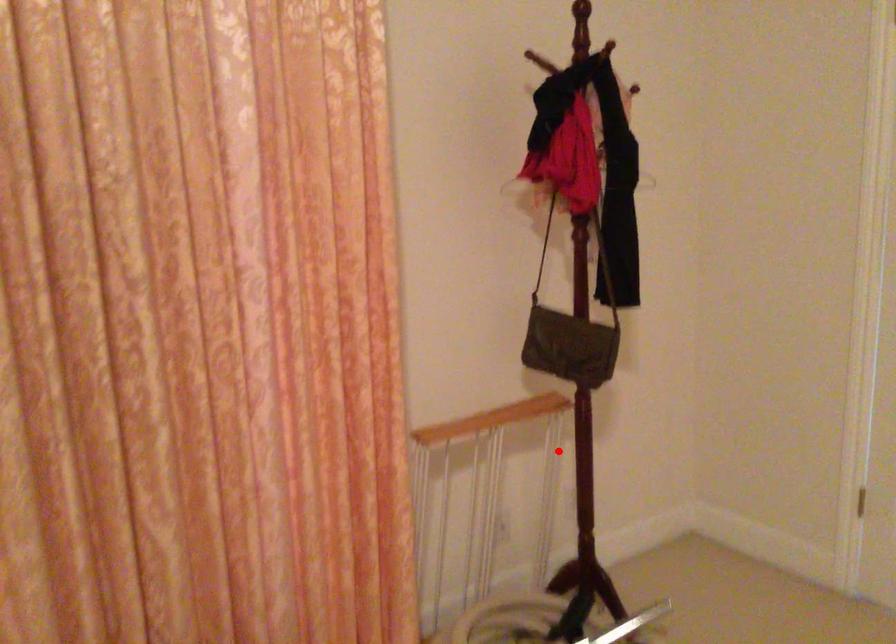
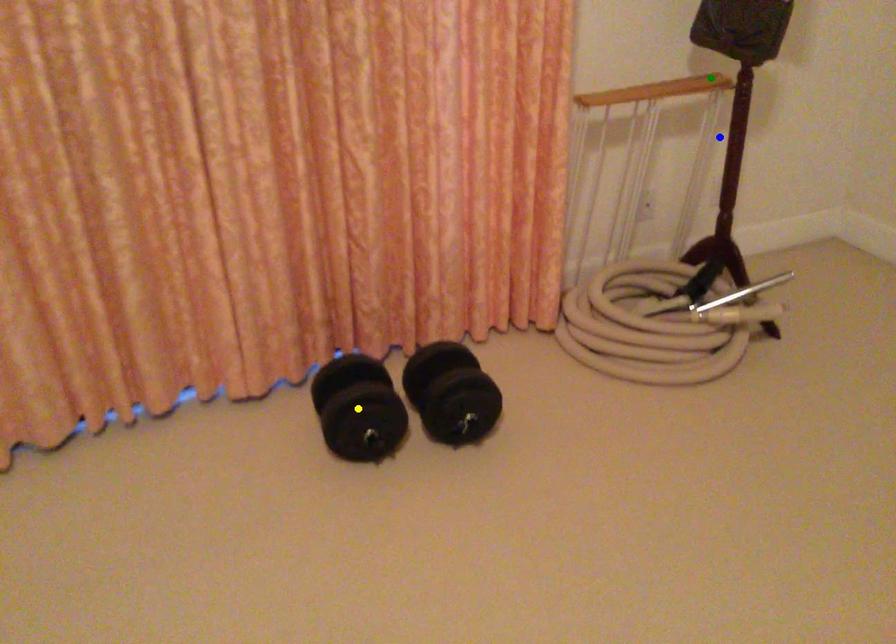
Question: I am providing you with two images of the same scene from different viewpoints. A red point is marked on the first image. You are given multiple points on the second image. Which spot in image 2 lines up with the point in image 1?

Choices:
 (A) green point
 (B) blue point
 (C) yellow point

Answer: (B)